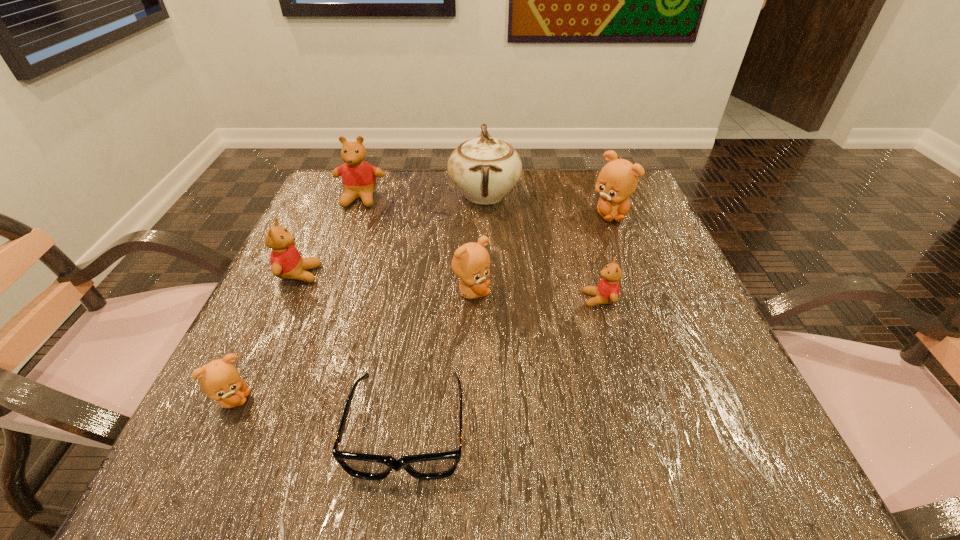
Locate an element on the screen. vacant area located 0.150m on the front-facing side of the seventh object from left to right is located at coordinates (502, 300).

You are a GUI agent. You are given a task and a screenshot of the screen. Output one action in this format:
    pyautogui.click(x=<x>, y=<y>)
    Task: Click on the vacant space located on the front-facing side of the seventh object from left to right
    The height and width of the screenshot is (540, 960).
    Given the screenshot: What is the action you would take?
    pyautogui.click(x=486, y=300)

This screenshot has width=960, height=540. What are the coordinates of `chinaware situated at the far edge` in the screenshot? It's located at (484, 169).

Find the location of `object that is at the near edge`. object that is at the near edge is located at coordinates (431, 466).

The width and height of the screenshot is (960, 540). Find the location of `object situated at the far left corner`. object situated at the far left corner is located at coordinates pyautogui.click(x=358, y=177).

At what (x,y) coordinates should I click in order to perform the action: click on object located in the far right corner section of the desktop. Please return your answer as a coordinate pair (x, y). The height and width of the screenshot is (540, 960). Looking at the image, I should click on (618, 179).

In the image, there is a desktop. Where is `free space at the far edge`? The width and height of the screenshot is (960, 540). free space at the far edge is located at coordinates (513, 194).

I want to click on vacant region at the near edge of the desktop, so click(588, 464).

Locate an element on the screen. Image resolution: width=960 pixels, height=540 pixels. vacant area at the left edge is located at coordinates (287, 350).

I want to click on free region at the right edge, so click(x=592, y=244).